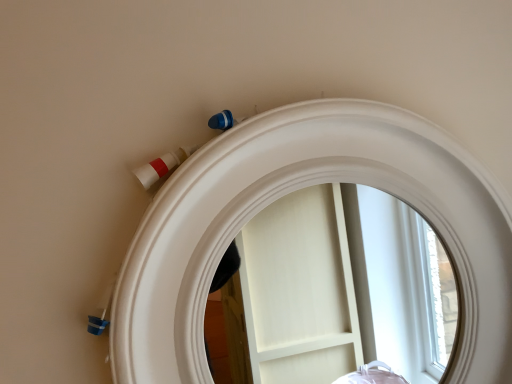
Question: Should I look upward or downward to see white glossy mirror at upper center?

Choices:
 (A) down
 (B) up

Answer: (A)